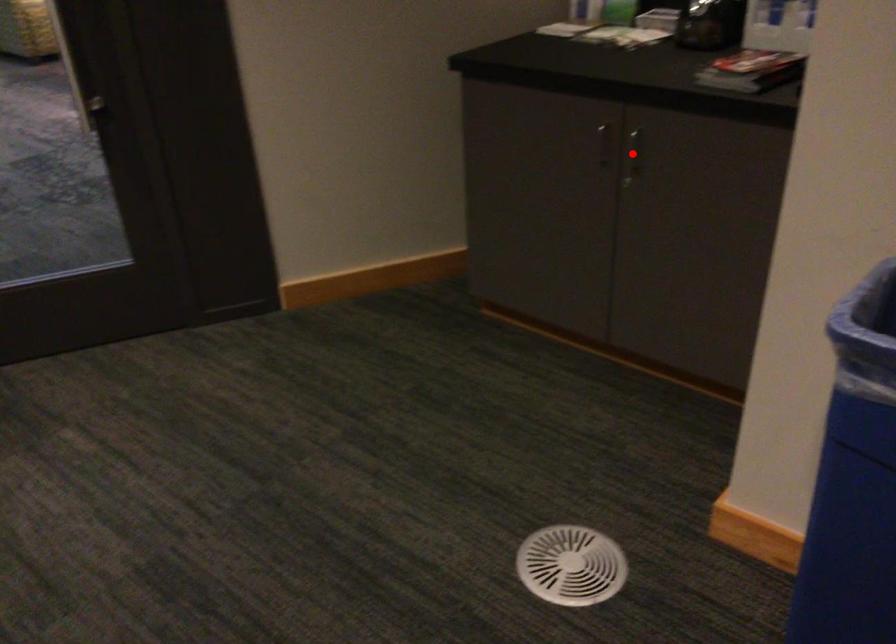
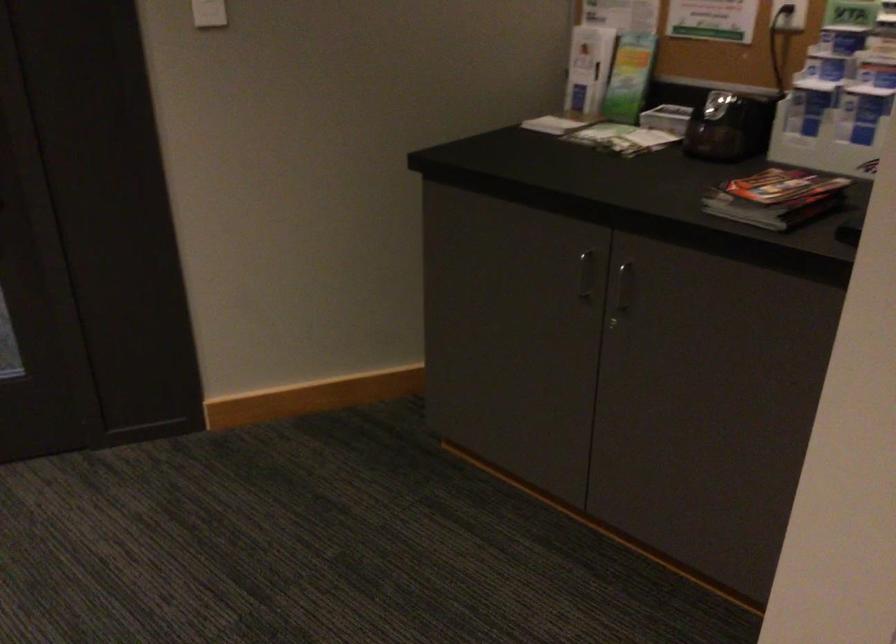
In the second image, find the point that corresponds to the highlighted location in the first image.

(622, 292)